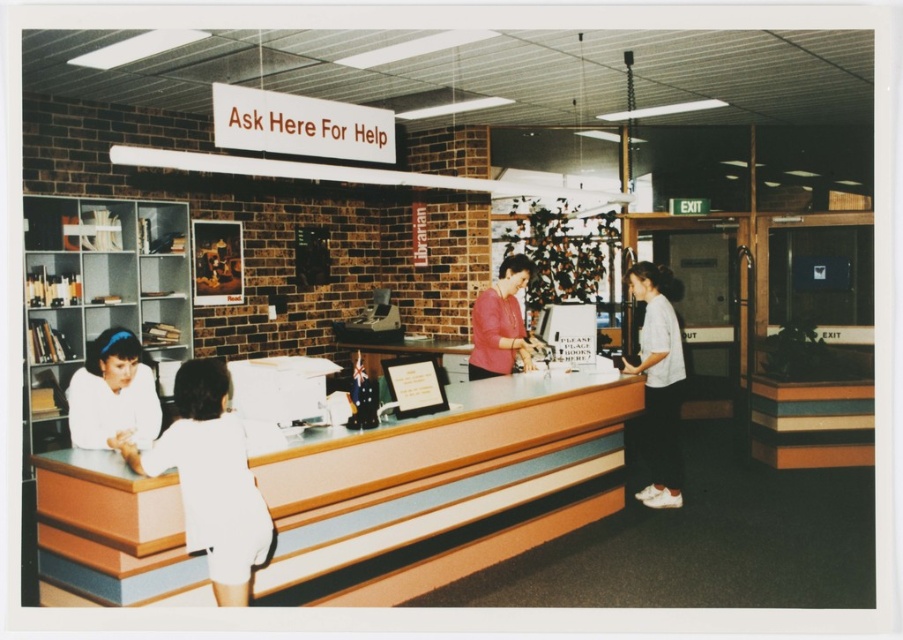
Question: Which of the following is the farthest from the observer?

Choices:
 (A) (107, 420)
 (B) (208, 548)
 (C) (49, 499)

Answer: (A)

Question: In this image, where is white fabric shirt at lower left located relative to white cotton shirt at right?

Choices:
 (A) right
 (B) left

Answer: (B)

Question: Can you confirm if wooden counter at center is positioned above white fabric shirt at left?

Choices:
 (A) no
 (B) yes

Answer: (A)

Question: Which of the following is the closest to the observer?

Choices:
 (A) (212, 400)
 (B) (107, 394)
 (C) (461, 456)
 (D) (669, 492)

Answer: (A)

Question: Does wooden counter at center have a lesser width compared to white fabric shirt at lower left?

Choices:
 (A) yes
 (B) no

Answer: (B)

Question: Which of the following is the farthest from the observer?

Choices:
 (A) wooden counter at center
 (B) white cotton shirt at right

Answer: (B)